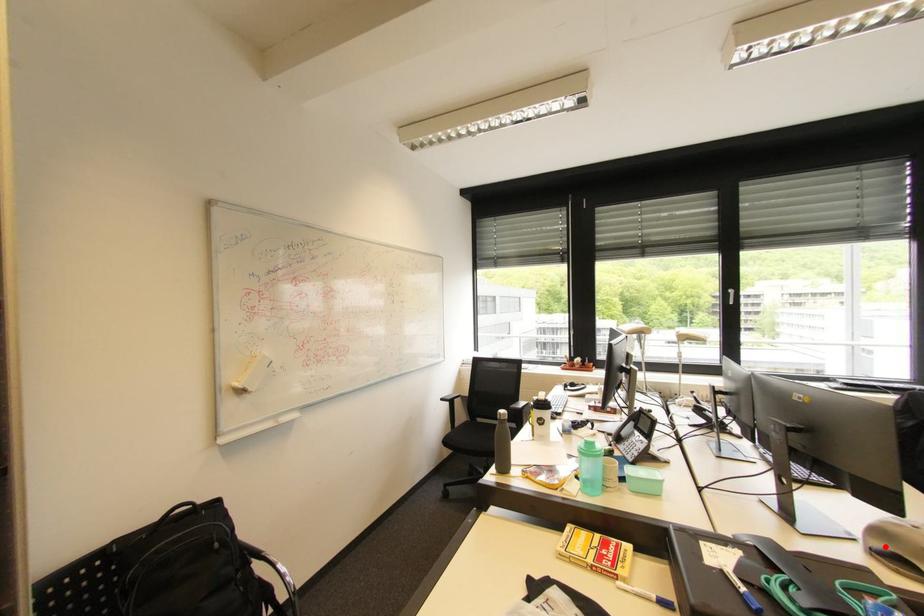
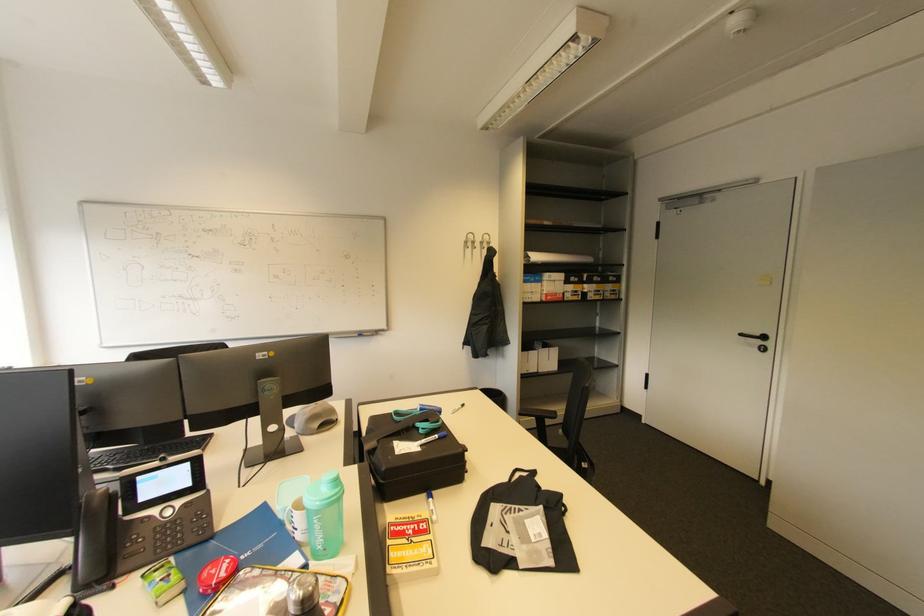
Locate, in the second image, the point that corresponds to the highlighted location in the first image.

(321, 426)